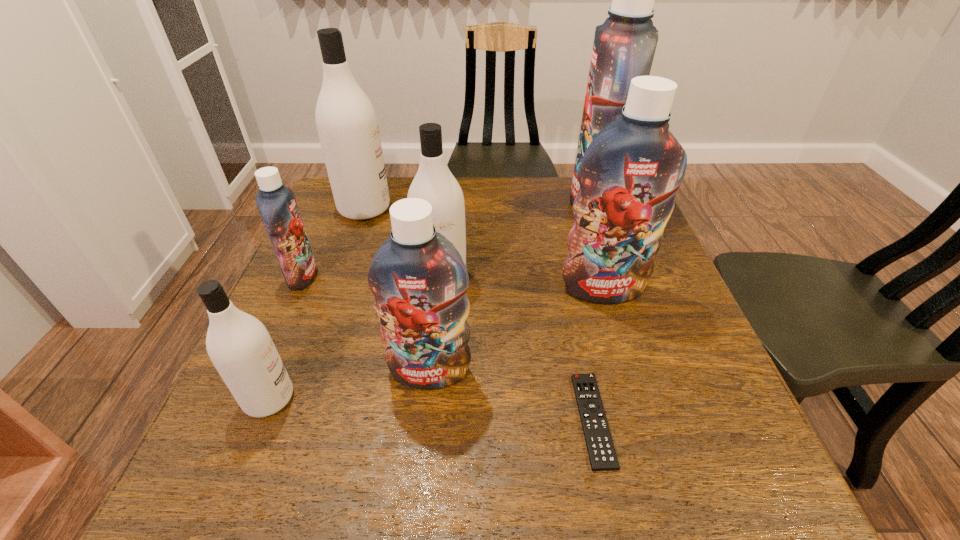
You are a GUI agent. You are given a task and a screenshot of the screen. Output one action in this format:
    pyautogui.click(x=<x>, y=<y>)
    Task: Click on the blank region between the smallest white shampoo and the remote control
    The width and height of the screenshot is (960, 540).
    Given the screenshot: What is the action you would take?
    pyautogui.click(x=431, y=409)

This screenshot has height=540, width=960. What are the coordinates of `unoccupied position between the third smallest blue shampoo and the shortest object` in the screenshot? It's located at (598, 354).

The height and width of the screenshot is (540, 960). Identify the location of the third closest object to the rightmost white shampoo. (629, 175).

This screenshot has height=540, width=960. I want to click on object identified as the second closest to the nearest white shampoo, so click(x=277, y=205).

The height and width of the screenshot is (540, 960). I want to click on shampoo that stands as the third closest to the smallest white shampoo, so click(x=434, y=182).

Identify which shampoo is located as the nearest to the third smallest blue shampoo. Please provide its 2D coordinates. Your answer should be formatted as a tuple, i.e. [(x, y)], where the tuple contains the x and y coordinates of a point satisfying the conditions above.

[(624, 45)]

Find the location of `the second closest blue shampoo to the rightmost white shampoo`. the second closest blue shampoo to the rightmost white shampoo is located at coordinates (629, 175).

The width and height of the screenshot is (960, 540). In order to click on the closest blue shampoo relative to the third biggest blue shampoo in this screenshot , I will do `click(629, 175)`.

Find the location of `white shampoo that is the second closest one to the smallest blue shampoo`. white shampoo that is the second closest one to the smallest blue shampoo is located at coordinates click(239, 345).

I want to click on the closest white shampoo relative to the tallest object, so click(434, 182).